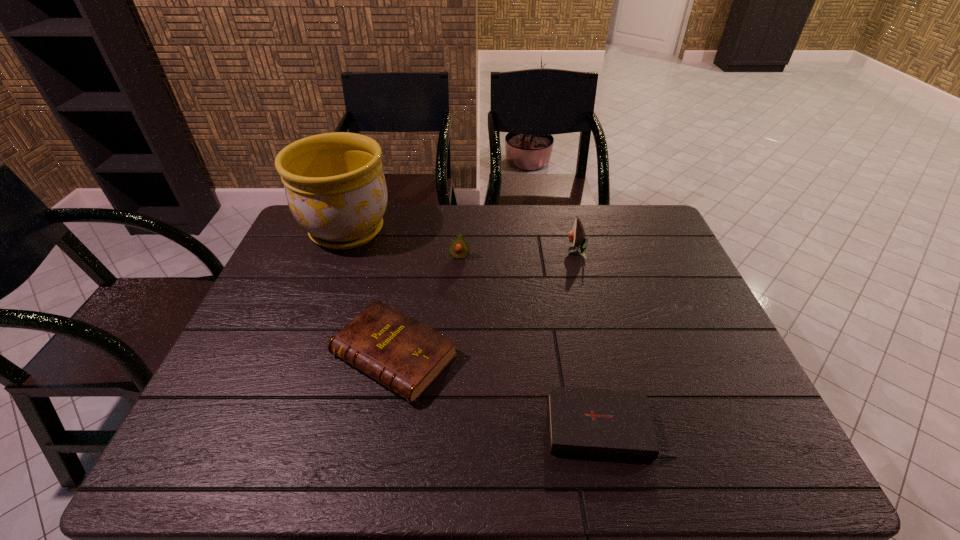
Locate an element on the screen. The image size is (960, 540). free region located 0.260m on the seed side of the taller avocado is located at coordinates (486, 251).

Where is `free space located on the cut side of the shorter avocado`? free space located on the cut side of the shorter avocado is located at coordinates (458, 278).

Locate an element on the screen. This screenshot has width=960, height=540. free space located 0.050m on the left of the fourth tallest object is located at coordinates (311, 355).

Where is `free space located 0.080m on the left of the shortest object`? Image resolution: width=960 pixels, height=540 pixels. free space located 0.080m on the left of the shortest object is located at coordinates (510, 428).

Locate an element on the screen. flowerpot that is positioned at the far edge is located at coordinates pos(335,187).

You are a GUI agent. You are given a task and a screenshot of the screen. Output one action in this format:
    pyautogui.click(x=<x>, y=<y>)
    Task: Click on the avocado situated at the far edge
    
    Given the screenshot: What is the action you would take?
    pyautogui.click(x=576, y=236)

This screenshot has width=960, height=540. Identify the location of object at the near edge. (603, 423).

Locate an element on the screen. Image resolution: width=960 pixels, height=540 pixels. object situated at the left edge is located at coordinates (335, 187).

The height and width of the screenshot is (540, 960). I want to click on object positioned at the far left corner, so click(335, 187).

Image resolution: width=960 pixels, height=540 pixels. What are the coordinates of `free location at the far edge` in the screenshot? It's located at (583, 208).